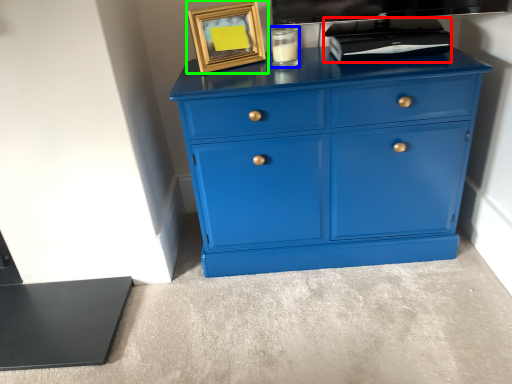
Question: Which is nearer to the appliance (highlighted by a red box)? candle holder (highlighted by a blue box) or picture frame (highlighted by a green box).

Choices:
 (A) candle holder
 (B) picture frame

Answer: (A)